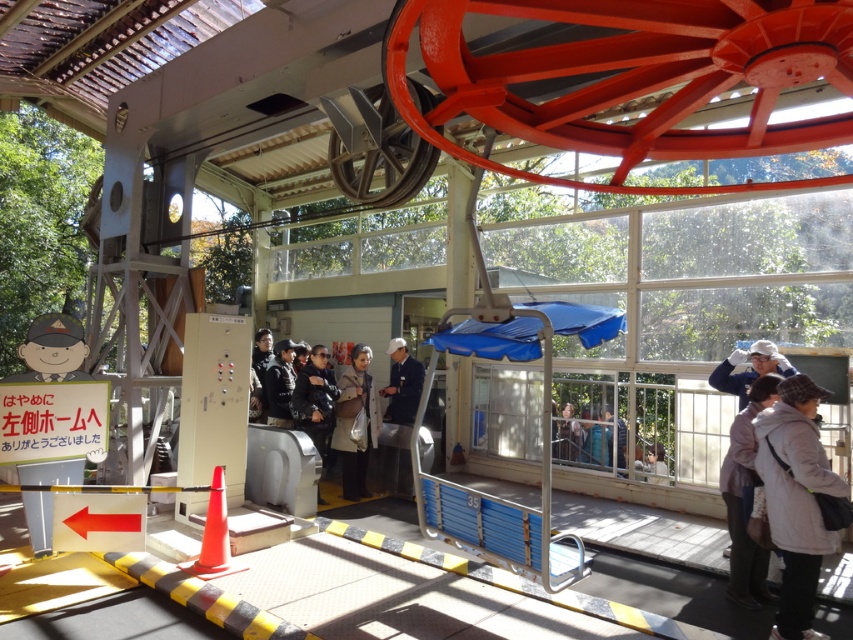
Question: Can you confirm if white fleece jacket at lower right is thinner than blue fabric canopy at center?

Choices:
 (A) no
 (B) yes

Answer: (B)

Question: Among these objects, which one is farthest from the camera?

Choices:
 (A) dark gray fabric coat at center
 (B) smooth yellow hat at left
 (C) white fleece jacket at lower right

Answer: (A)

Question: Considering the real-world distances, which object is closest to the blue fabric canopy at center?

Choices:
 (A) dark gray fabric coat at center
 (B) dark blue uniform at center
 (C) smooth yellow hat at left
 (D) white fleece jacket at lower right

Answer: (A)

Question: From the image, what is the correct spatial relationship of white fleece jacket at lower right in relation to blue fabric canopy at center?

Choices:
 (A) above
 (B) below

Answer: (B)

Question: Is dark blue uniform at center thinner than smooth yellow hat at left?

Choices:
 (A) yes
 (B) no

Answer: (B)

Question: Which point appears farthest from the camera in this image?

Choices:
 (A) (21, 356)
 (B) (405, 396)
 (C) (838, 481)

Answer: (B)